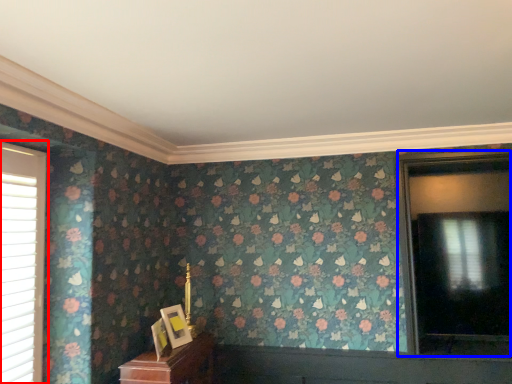
Question: Which of the following is the closest to the observer, window (highlighted by a red box) or window (highlighted by a blue box)?

Choices:
 (A) window
 (B) window

Answer: (A)